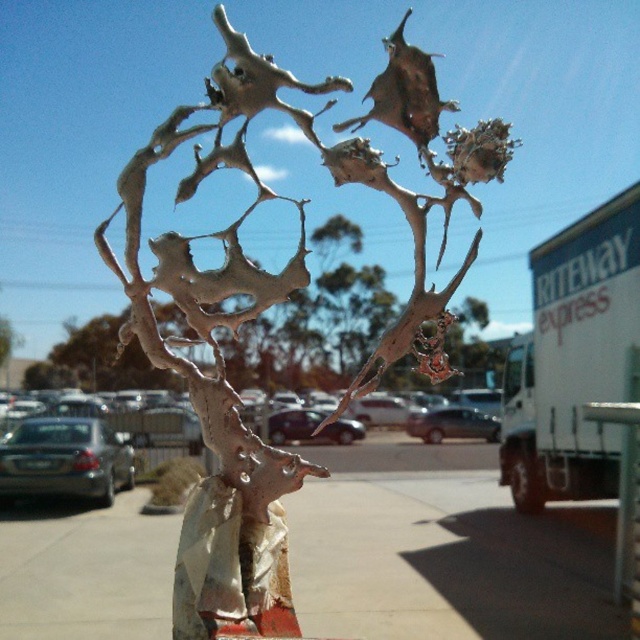
You are standing on the smooth concrete sidewalk at center and want to walk towards the parking lot. Which direction should you face to move away from the matte silver sculpture at center?

Since the matte silver sculpture at center is to the left of the smooth concrete sidewalk at center, you should face to the right to move away from the sculpture and towards the parking lot.

You are standing in front of the metallic sculpture and looking towards the parking lot. There are two points marked on the ground in front of you. The first point is at coordinates point [193,637] and the second is at point [12,636]. Which point is closer to you?

Point [193,637] is closer to you because it is in front of point [12,636].